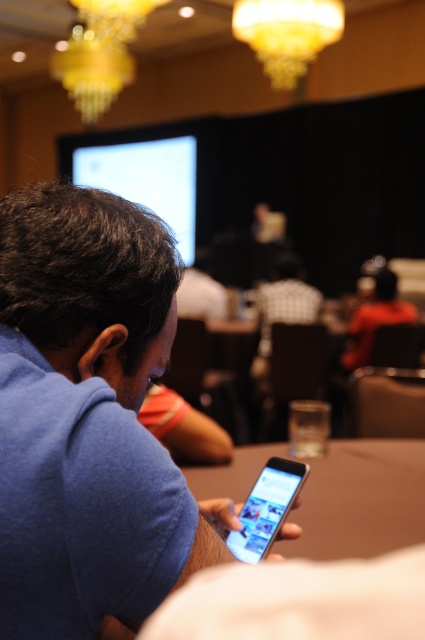
Which is below, silver metallic smartphone at center or orange shirt at center?

Answer: silver metallic smartphone at center is lower down.

Is silver metallic smartphone at center to the left of orange shirt at center from the viewer's perspective?

Indeed, silver metallic smartphone at center is positioned on the left side of orange shirt at center.

Which is behind, point (255, 496) or point (362, 356)?

Positioned behind is point (362, 356).

The width and height of the screenshot is (425, 640). In order to click on silver metallic smartphone at center in this screenshot , I will do `click(266, 508)`.

Is brown wooden table at center below silver metallic smartphone at center?

Correct, brown wooden table at center is located below silver metallic smartphone at center.

You are a GUI agent. You are given a task and a screenshot of the screen. Output one action in this format:
    pyautogui.click(x=<x>, y=<y>)
    Task: Click on the brown wooden table at center
    
    Given the screenshot: What is the action you would take?
    pyautogui.click(x=360, y=500)

Where is `brown wooden table at center`? The image size is (425, 640). brown wooden table at center is located at coordinates (360, 500).

Can you confirm if brown wooden table at center is positioned to the left of orange shirt at center?

Correct, you'll find brown wooden table at center to the left of orange shirt at center.

Identify the location of brown wooden table at center. (360, 500).

Describe the element at coordinates (360, 500) in the screenshot. I see `brown wooden table at center` at that location.

Identify the location of brown wooden table at center. The height and width of the screenshot is (640, 425). pyautogui.click(x=360, y=500).